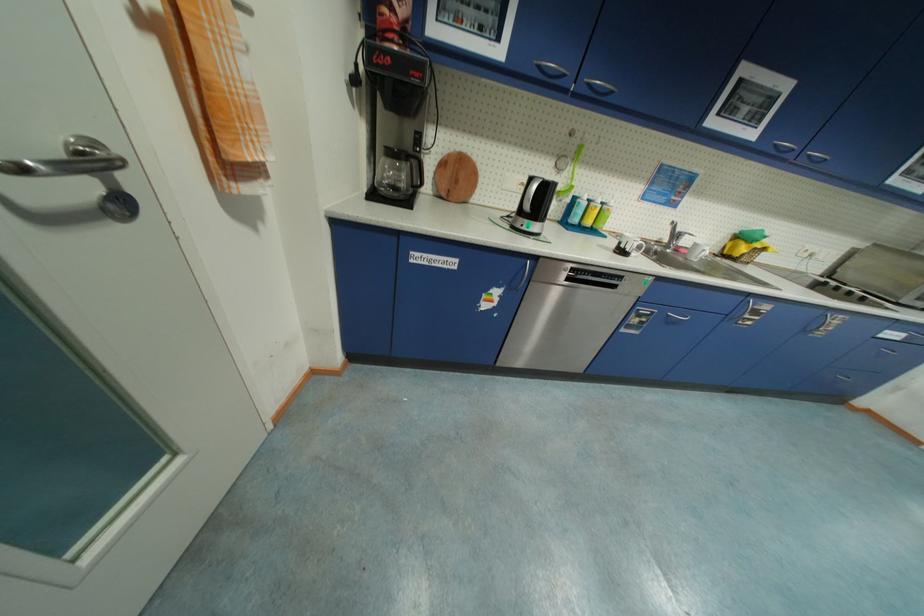
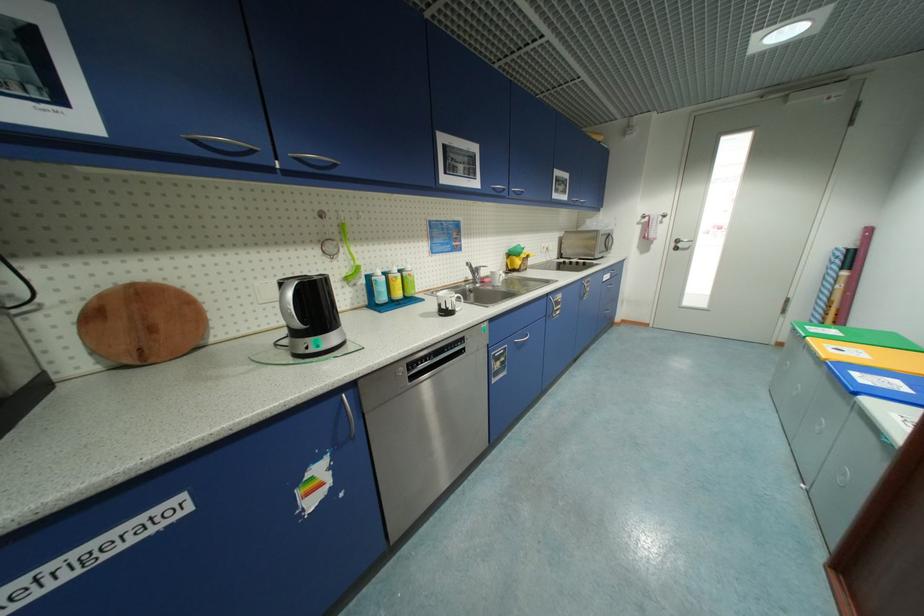
In the second image, find the point that corresponds to [796,156] in the first image.

(512, 195)